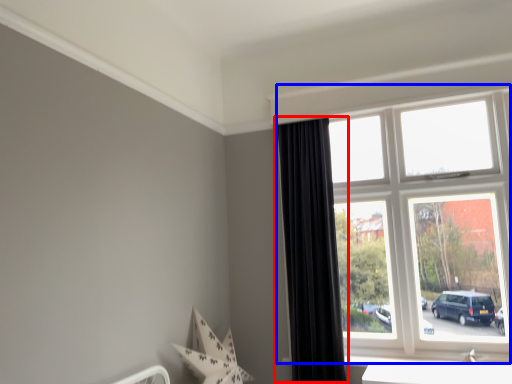
Question: Which point is further to the camera, curtain (highlighted by a red box) or window (highlighted by a blue box)?

Choices:
 (A) curtain
 (B) window

Answer: (A)